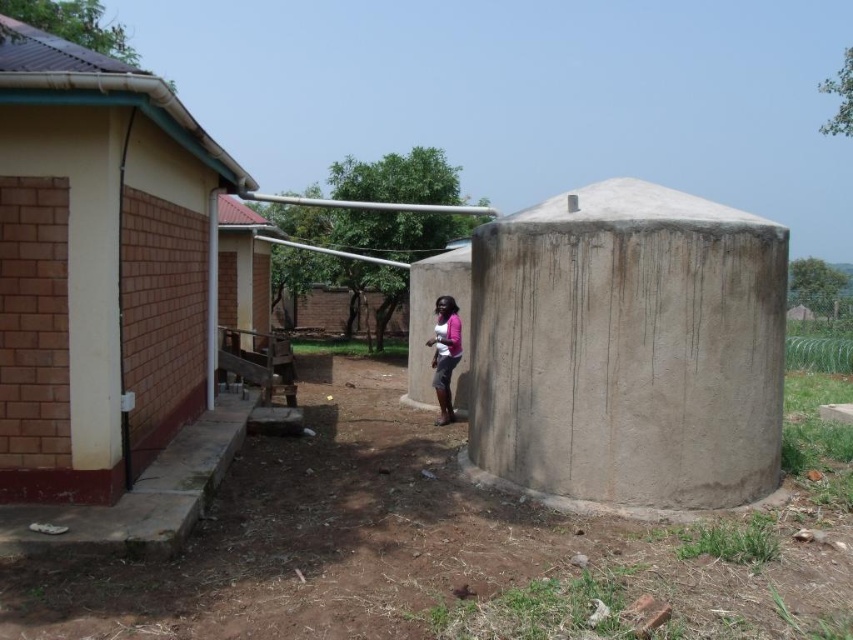
You are taking a photo of the scene and want to focus on both point (138, 196) and point (753, 468). Which point should you focus on first to ensure both are in sharp focus?

You should focus on point (138, 196) first because it is closer to the camera than point (753, 468). By focusing on the closer point, the farther point will also be within the depth of field and appear sharp.

You are standing at the base of the brown brick wall at left and want to walk to the brown soil at center. Which direction should you move in?

You should move to the right to reach the brown soil at center from the brown brick wall at left since the brown soil at center is located to the right of the brown brick wall at left.

Looking at this image, you are a gardener planning to plant flowers in the brown soil at center near the brown brick wall at left. Based on their positions, which object is lower in height?

The brown soil at center is below the brown brick wall at left, so the brown soil at center is lower in height.